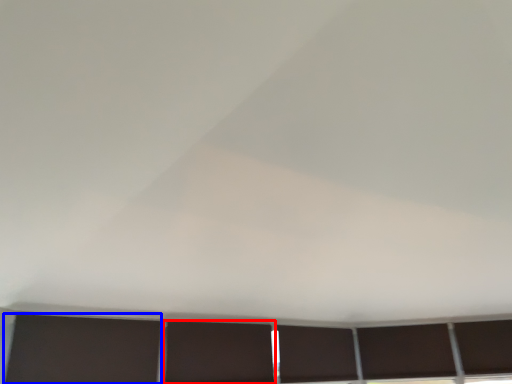
Question: Among these objects, which one is nearest to the camera, shutter (highlighted by a red box) or shutter (highlighted by a blue box)?

Choices:
 (A) shutter
 (B) shutter

Answer: (B)